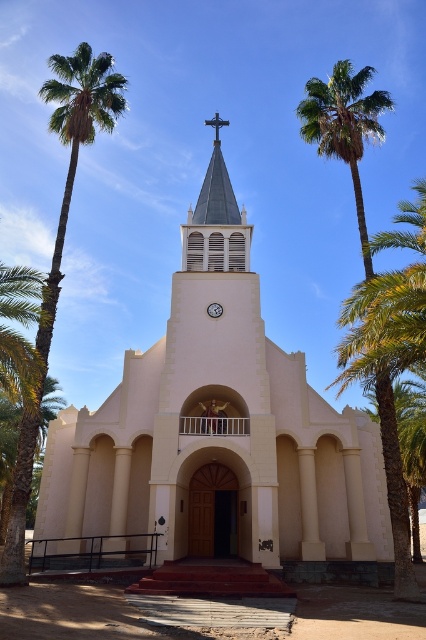
Question: Can you confirm if green leafy palm tree at left is positioned below metallic clock at center?

Choices:
 (A) yes
 (B) no

Answer: (B)

Question: Among these points, which one is nearest to the camera?

Choices:
 (A) (213, 305)
 (B) (360, 93)
 (C) (207, 330)

Answer: (B)

Question: Is white smooth church at center to the right of metallic clock at center from the viewer's perspective?

Choices:
 (A) yes
 (B) no

Answer: (B)

Question: Which object is the farthest from the white smooth church at center?

Choices:
 (A) metallic clock at center
 (B) green leafy palm tree at upper right

Answer: (B)

Question: Which object appears closest to the camera in this image?

Choices:
 (A) white smooth church at center
 (B) metallic clock at center
 (C) green leafy palm tree at upper right

Answer: (A)

Question: Where is green leafy palm tree at left located in relation to green leafy palm tree at upper right in the image?

Choices:
 (A) below
 (B) above

Answer: (A)